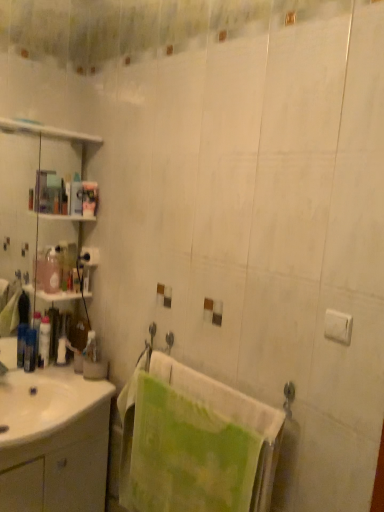
Question: Should I look upward or downward to see translucent plastic bottle at left, acting as the first toiletry starting from the right?

Choices:
 (A) down
 (B) up

Answer: (A)

Question: Could you tell me if translucent plastic bottle at left, the 5th toiletry positioned from the right, is facing translucent plastic bottle at left, acting as the first toiletry starting from the right?

Choices:
 (A) no
 (B) yes

Answer: (A)

Question: Is there a large distance between translucent plastic bottle at left, the 5th toiletry positioned from the right, and translucent plastic bottle at left, acting as the first toiletry starting from the right?

Choices:
 (A) no
 (B) yes

Answer: (A)

Question: From a real-world perspective, is translucent plastic bottle at left, the 1th toiletry from the left, positioned under translucent plastic bottle at left, which is counted as the 5th toiletry, starting from the left, based on gravity?

Choices:
 (A) no
 (B) yes

Answer: (A)

Question: Does translucent plastic bottle at left, the 1th toiletry from the left, have a greater height compared to translucent plastic bottle at left, which is counted as the 5th toiletry, starting from the left?

Choices:
 (A) no
 (B) yes

Answer: (A)

Question: Is translucent plastic bottle at left, the 5th toiletry positioned from the right, in front of translucent plastic bottle at left, acting as the first toiletry starting from the right?

Choices:
 (A) no
 (B) yes

Answer: (B)

Question: Does translucent plastic bottle at left, the 5th toiletry positioned from the right, have a greater width compared to translucent plastic bottle at left, which is counted as the 5th toiletry, starting from the left?

Choices:
 (A) yes
 (B) no

Answer: (A)

Question: Does white glossy cabinet at lower left come behind translucent plastic bottle at left, acting as the first toiletry starting from the right?

Choices:
 (A) no
 (B) yes

Answer: (A)

Question: From a real-world perspective, is white glossy cabinet at lower left physically above translucent plastic bottle at left, acting as the first toiletry starting from the right?

Choices:
 (A) no
 (B) yes

Answer: (A)

Question: From the image's perspective, does white glossy cabinet at lower left appear lower than translucent plastic bottle at left, which is counted as the 5th toiletry, starting from the left?

Choices:
 (A) no
 (B) yes

Answer: (B)

Question: Is white glossy cabinet at lower left to the left of translucent plastic bottle at left, which is counted as the 5th toiletry, starting from the left, from the viewer's perspective?

Choices:
 (A) no
 (B) yes

Answer: (B)

Question: Does white glossy cabinet at lower left have a greater height compared to translucent plastic bottle at left, acting as the first toiletry starting from the right?

Choices:
 (A) no
 (B) yes

Answer: (B)

Question: Does white glossy cabinet at lower left have a larger size compared to translucent plastic bottle at left, which is counted as the 5th toiletry, starting from the left?

Choices:
 (A) yes
 (B) no

Answer: (A)

Question: Is the position of white matte toilet paper at upper left less distant than that of white glossy lotion at left, marked as the 2th toiletry in a left-to-right arrangement?

Choices:
 (A) yes
 (B) no

Answer: (B)